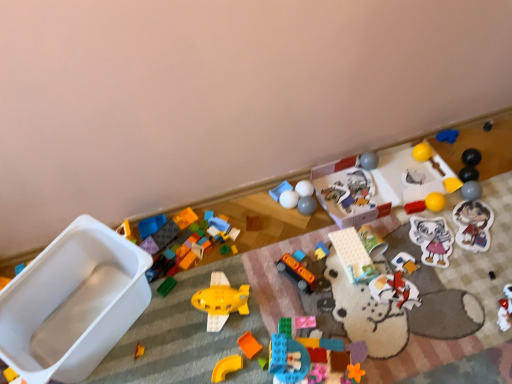
Where is `free area in between white plastic container at left, which is the 1th toy in left-to-right order, and yellow plastic airplane at center, the 22th toy in the right-to-left sequence`? The image size is (512, 384). free area in between white plastic container at left, which is the 1th toy in left-to-right order, and yellow plastic airplane at center, the 22th toy in the right-to-left sequence is located at coordinates (177, 331).